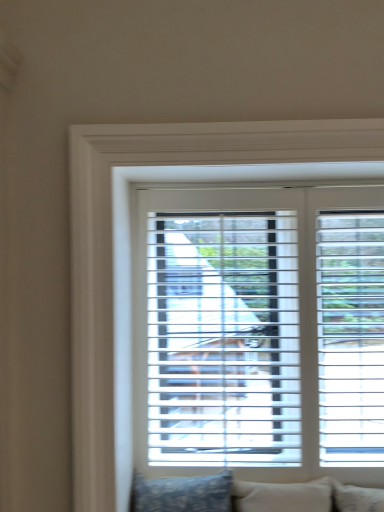
What do you see at coordinates (131, 250) in the screenshot? I see `white plastic blinds at center` at bounding box center [131, 250].

Identify the location of blue patterned pillow at lower center, arranged as the 1th pillow when viewed from the left. This screenshot has height=512, width=384. (182, 494).

Image resolution: width=384 pixels, height=512 pixels. Describe the element at coordinates (182, 494) in the screenshot. I see `blue patterned pillow at lower center, which ranks as the second pillow in right-to-left order` at that location.

This screenshot has width=384, height=512. I want to click on white plastic blinds at center, so coord(131,250).

Considering the sizes of white plastic blinds at center and beige fabric pillow at lower center, which is the 1th pillow from right to left, in the image, is white plastic blinds at center taller or shorter than beige fabric pillow at lower center, which is the 1th pillow from right to left,?

In the image, white plastic blinds at center appears to be taller than beige fabric pillow at lower center, which is the 1th pillow from right to left.

From a real-world perspective, is white plastic blinds at center positioned above or below beige fabric pillow at lower center, which is the 1th pillow from right to left?

white plastic blinds at center is situated higher than beige fabric pillow at lower center, which is the 1th pillow from right to left, in the real world.

In the scene shown: In terms of width, does white plastic blinds at center look wider or thinner when compared to beige fabric pillow at lower center, which is the 1th pillow from right to left?

Considering their sizes, white plastic blinds at center looks slimmer than beige fabric pillow at lower center, which is the 1th pillow from right to left.

Is white plastic blinds at center far from beige fabric pillow at lower center, acting as the second pillow starting from the left?

That's not correct — white plastic blinds at center is a little close to beige fabric pillow at lower center, acting as the second pillow starting from the left.

Is beige fabric pillow at lower center, which is the 1th pillow from right to left, wider than blue patterned pillow at lower center, which ranks as the second pillow in right-to-left order?

No.

What's the angular difference between beige fabric pillow at lower center, which is the 1th pillow from right to left, and blue patterned pillow at lower center, arranged as the 1th pillow when viewed from the left,'s facing directions?

There is a 0.719-degree angle between the facing directions of beige fabric pillow at lower center, which is the 1th pillow from right to left, and blue patterned pillow at lower center, arranged as the 1th pillow when viewed from the left.

Where is `pillow lying in front of the beige fabric pillow at lower center, which is the 1th pillow from right to left`? pillow lying in front of the beige fabric pillow at lower center, which is the 1th pillow from right to left is located at coordinates (182, 494).

Could you tell me if blue patterned pillow at lower center, which ranks as the second pillow in right-to-left order, is facing white plastic blinds at center?

No, blue patterned pillow at lower center, which ranks as the second pillow in right-to-left order, is not oriented towards white plastic blinds at center.

Can you confirm if blue patterned pillow at lower center, arranged as the 1th pillow when viewed from the left, is smaller than white plastic blinds at center?

Indeed, blue patterned pillow at lower center, arranged as the 1th pillow when viewed from the left, has a smaller size compared to white plastic blinds at center.

Between point (176, 479) and point (81, 498), which one is positioned in front?

The point (81, 498) is in front.

Is beige fabric pillow at lower center, acting as the second pillow starting from the left, oriented away from white plastic blinds at center?

Yes, beige fabric pillow at lower center, acting as the second pillow starting from the left,'s orientation is away from white plastic blinds at center.

Which is more to the right, beige fabric pillow at lower center, acting as the second pillow starting from the left, or white plastic blinds at center?

From the viewer's perspective, beige fabric pillow at lower center, acting as the second pillow starting from the left, appears more on the right side.

Is beige fabric pillow at lower center, which is the 1th pillow from right to left, not within white plastic blinds at center?

Indeed, beige fabric pillow at lower center, which is the 1th pillow from right to left, is completely outside white plastic blinds at center.

Does point (284, 147) come farther from viewer compared to point (216, 496)?

No, it is in front of (216, 496).

Is white plastic blinds at center bigger than blue patterned pillow at lower center, which ranks as the second pillow in right-to-left order?

Indeed, white plastic blinds at center has a larger size compared to blue patterned pillow at lower center, which ranks as the second pillow in right-to-left order.

Can you see white plastic blinds at center touching blue patterned pillow at lower center, arranged as the 1th pillow when viewed from the left?

No, white plastic blinds at center is not making contact with blue patterned pillow at lower center, arranged as the 1th pillow when viewed from the left.

From the picture: In terms of height, does white plastic blinds at center look taller or shorter compared to blue patterned pillow at lower center, arranged as the 1th pillow when viewed from the left?

In the image, white plastic blinds at center appears to be taller than blue patterned pillow at lower center, arranged as the 1th pillow when viewed from the left.

Who is smaller, blue patterned pillow at lower center, which ranks as the second pillow in right-to-left order, or beige fabric pillow at lower center, which is the 1th pillow from right to left?

beige fabric pillow at lower center, which is the 1th pillow from right to left, is smaller.

Is beige fabric pillow at lower center, acting as the second pillow starting from the left, at the back of blue patterned pillow at lower center, arranged as the 1th pillow when viewed from the left?

No, blue patterned pillow at lower center, arranged as the 1th pillow when viewed from the left, is not facing the opposite direction of beige fabric pillow at lower center, acting as the second pillow starting from the left.

Does point (142, 493) appear closer or farther from the camera than point (245, 498)?

Point (142, 493) is positioned closer to the camera compared to point (245, 498).

Which is behind, blue patterned pillow at lower center, arranged as the 1th pillow when viewed from the left, or beige fabric pillow at lower center, acting as the second pillow starting from the left?

beige fabric pillow at lower center, acting as the second pillow starting from the left, is further away from the camera.

Find the location of `window above the beige fabric pillow at lower center, which is the 1th pillow from right to left (from a real-world perspective)`. window above the beige fabric pillow at lower center, which is the 1th pillow from right to left (from a real-world perspective) is located at coordinates (131, 250).

Find the location of `pillow located behind the blue patterned pillow at lower center, which ranks as the second pillow in right-to-left order`. pillow located behind the blue patterned pillow at lower center, which ranks as the second pillow in right-to-left order is located at coordinates (283, 496).

Looking at this image, from the image, which object appears to be nearer to blue patterned pillow at lower center, arranged as the 1th pillow when viewed from the left, white plastic blinds at center or beige fabric pillow at lower center, which is the 1th pillow from right to left?

beige fabric pillow at lower center, which is the 1th pillow from right to left.

From the picture: Looking at the image, which one is located further to white plastic blinds at center, blue patterned pillow at lower center, arranged as the 1th pillow when viewed from the left, or beige fabric pillow at lower center, which is the 1th pillow from right to left?

The object further to white plastic blinds at center is beige fabric pillow at lower center, which is the 1th pillow from right to left.

Based on their spatial positions, is beige fabric pillow at lower center, acting as the second pillow starting from the left, or blue patterned pillow at lower center, which ranks as the second pillow in right-to-left order, further from white plastic blinds at center?

Among the two, beige fabric pillow at lower center, acting as the second pillow starting from the left, is located further to white plastic blinds at center.

Based on the photo, which object lies nearer to the anchor point beige fabric pillow at lower center, which is the 1th pillow from right to left, white plastic blinds at center or blue patterned pillow at lower center, which ranks as the second pillow in right-to-left order?

blue patterned pillow at lower center, which ranks as the second pillow in right-to-left order, lies closer to beige fabric pillow at lower center, which is the 1th pillow from right to left, than the other object.

Looking at the image, which one is located further to blue patterned pillow at lower center, arranged as the 1th pillow when viewed from the left, beige fabric pillow at lower center, which is the 1th pillow from right to left, or white plastic blinds at center?

Based on the image, white plastic blinds at center appears to be further to blue patterned pillow at lower center, arranged as the 1th pillow when viewed from the left.

When comparing their distances from beige fabric pillow at lower center, which is the 1th pillow from right to left, does blue patterned pillow at lower center, arranged as the 1th pillow when viewed from the left, or white plastic blinds at center seem further?

Based on the image, white plastic blinds at center appears to be further to beige fabric pillow at lower center, which is the 1th pillow from right to left.

This screenshot has height=512, width=384. In order to click on pillow between white plastic blinds at center and beige fabric pillow at lower center, acting as the second pillow starting from the left, in the up-down direction in this screenshot , I will do `click(182, 494)`.